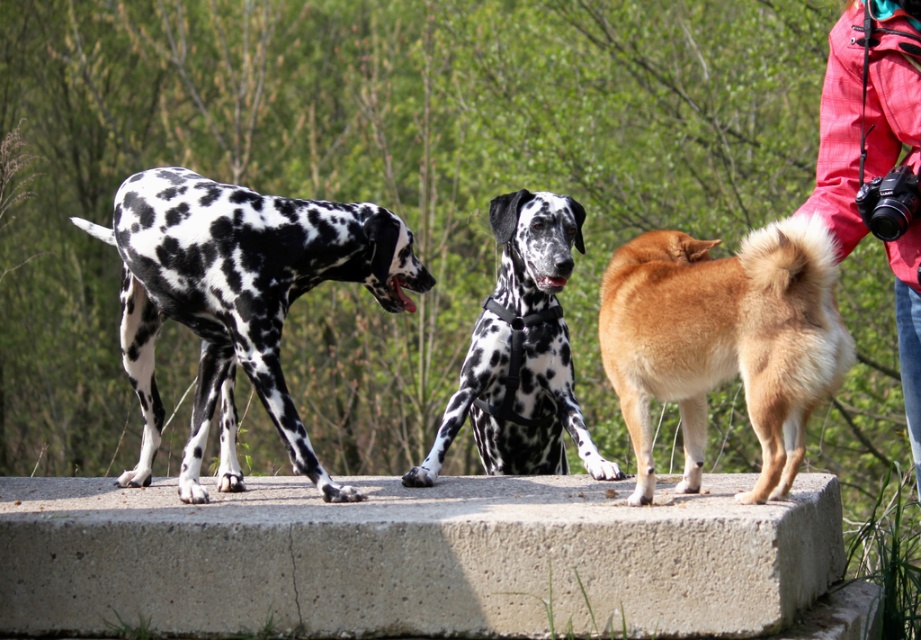
Can you confirm if concreteroughconcrete at center is bigger than black and white spotted dog at left?

Yes, concreteroughconcrete at center is bigger than black and white spotted dog at left.

Between point (177, 616) and point (259, 227), which one is positioned behind?

Point (259, 227)

Who is more forward, (835,541) or (115,481)?

Point (835,541) is more forward.

Where is `concreteroughconcrete at center`? The height and width of the screenshot is (640, 921). concreteroughconcrete at center is located at coordinates (412, 557).

What do you see at coordinates (724, 340) in the screenshot? I see `golden fur dog at center` at bounding box center [724, 340].

Is the position of golden fur dog at center more distant than that of red plaid jacket at upper right?

Yes, it is behind red plaid jacket at upper right.

Which is in front, point (649, 353) or point (881, 84)?

Point (881, 84) is in front.

Identify the location of golden fur dog at center. This screenshot has height=640, width=921. (724, 340).

Between black and white spotted dog at left and spotted fur harness at center, which one is positioned higher?

black and white spotted dog at left is higher up.

At what (x,y) coordinates should I click in order to perform the action: click on black and white spotted dog at left. Please return your answer as a coordinate pair (x, y). The image size is (921, 640). Looking at the image, I should click on (239, 300).

Find the location of a particular element. black and white spotted dog at left is located at coordinates (239, 300).